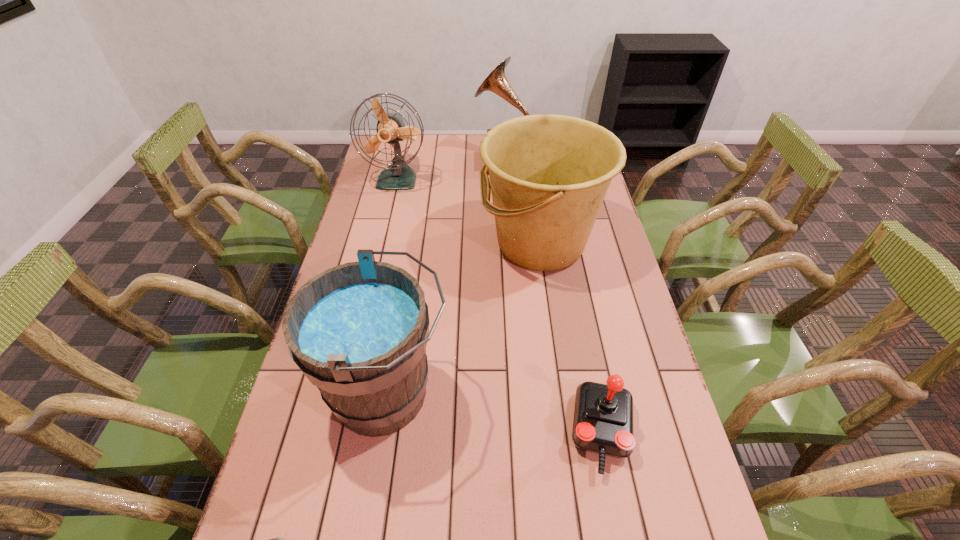
Locate an element on the screen. Image resolution: width=960 pixels, height=540 pixels. free space located on the side of the third farthest object with the handle is located at coordinates (390, 244).

Find the location of a particular element. vacant region located 0.080m on the front-facing side of the fan for air flow is located at coordinates (391, 211).

Identify the location of free space located 0.110m with a handle on the side of the wine bucket. Image resolution: width=960 pixels, height=540 pixels. (498, 394).

Where is `free spot located on the back of the joystick`? The image size is (960, 540). free spot located on the back of the joystick is located at coordinates (577, 307).

The height and width of the screenshot is (540, 960). I want to click on record player present at the far edge, so pyautogui.click(x=496, y=81).

Find the location of `fan located at the far edge`. fan located at the far edge is located at coordinates (391, 129).

At what (x,y) coordinates should I click in order to perform the action: click on fan that is at the left edge. Please return your answer as a coordinate pair (x, y). Image resolution: width=960 pixels, height=540 pixels. Looking at the image, I should click on (391, 129).

The image size is (960, 540). Find the location of `wine bucket that is at the left edge`. wine bucket that is at the left edge is located at coordinates (358, 331).

Where is `bucket at the right edge`? The width and height of the screenshot is (960, 540). bucket at the right edge is located at coordinates (549, 174).

Find the location of a particular element. joystick present at the right edge is located at coordinates (603, 416).